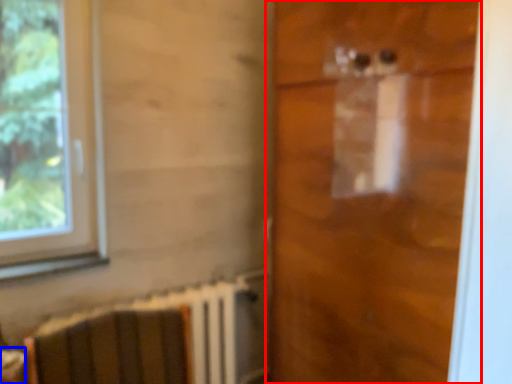
Question: Among these objects, which one is farthest to the camera, door (highlighted by a red box) or table (highlighted by a blue box)?

Choices:
 (A) door
 (B) table

Answer: (B)